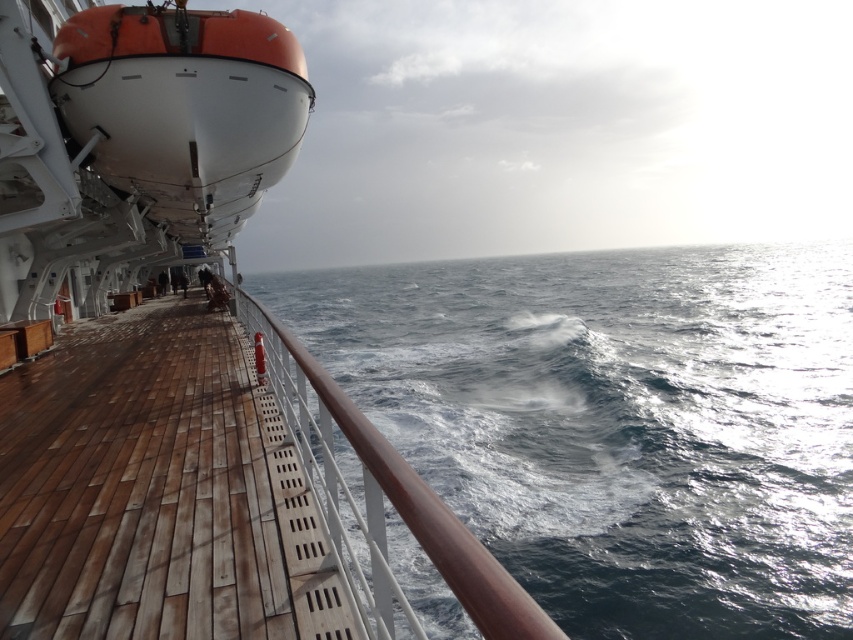
You are standing on the ship and looking out. The blue water at center and the brown wooden deck at center are both visible. Which one takes up more space in your view?

The blue water at center takes up more space because it has a larger size compared to the brown wooden deck at center.

You are a sailor on the ship deck. You need to move from the orange matte lifeboat at upper left to the brown polished wood at center. Which direction should you move in?

To move from the orange matte lifeboat at upper left to the brown polished wood at center, you should move forward since the brown polished wood at center is behind the orange matte lifeboat at upper left.

Consider the image. You are navigating a small drone on the ship deck. You need to fly from point A to point B. The coordinates for point A are at (345, 426) and point B are at (286, 460). According to the scene, which point is closer to the edge of the deck?

Point A at (345, 426) is closer to the edge of the deck because point B at (286, 460) is behind it, meaning it is further away from the edge.